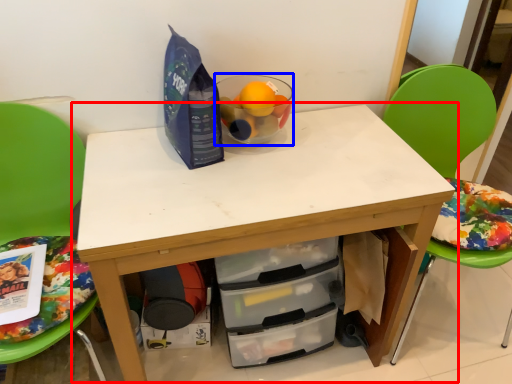
Question: Among these objects, which one is farthest to the camera, table (highlighted by a red box) or bowl (highlighted by a blue box)?

Choices:
 (A) table
 (B) bowl

Answer: (B)